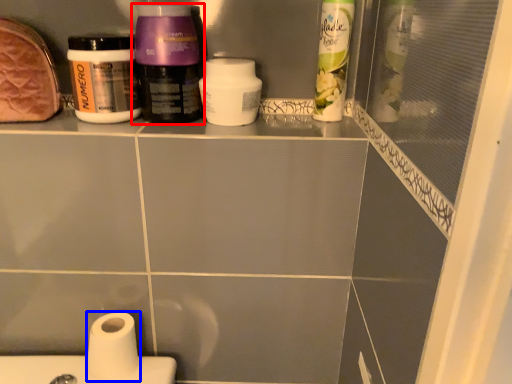
Question: Which of the following is the closest to the observer, bottle (highlighted by a red box) or toilet paper (highlighted by a blue box)?

Choices:
 (A) bottle
 (B) toilet paper

Answer: (A)